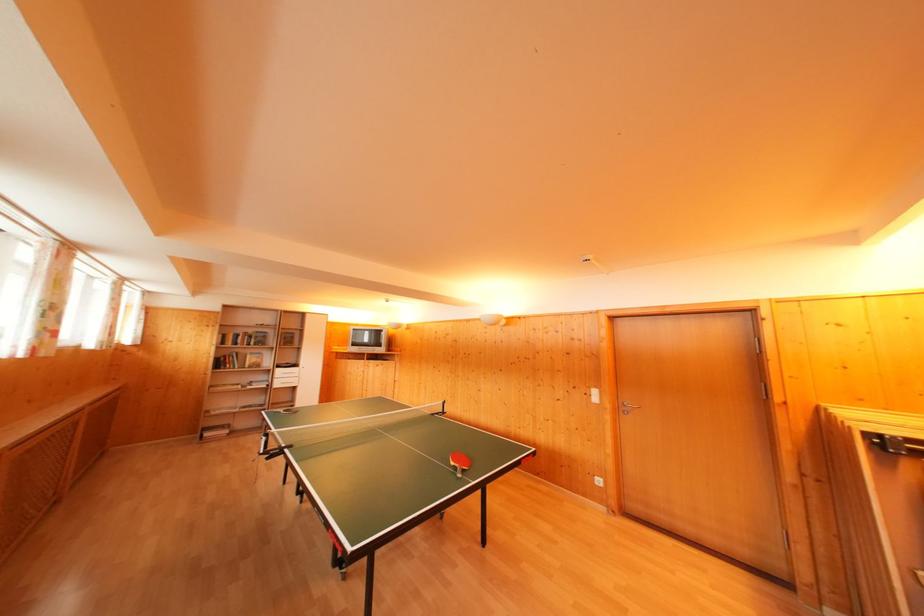
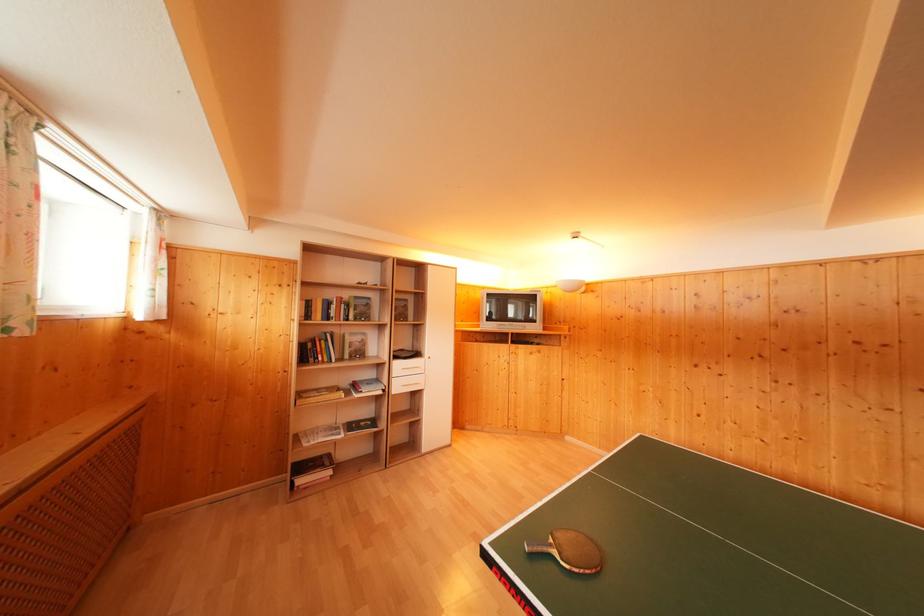
Where in the second image is the point corresponding to (252,357) from the first image?

(350, 336)